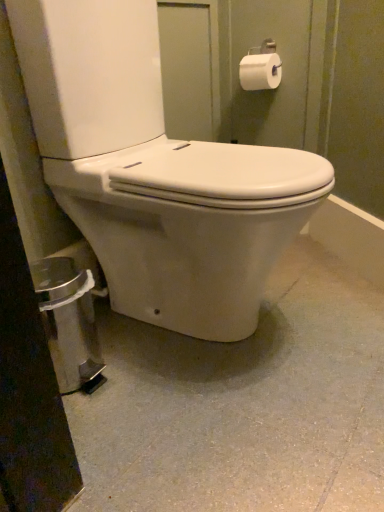
Question: Could white matte toilet paper at upper right be considered to be inside white smooth concrete at center?

Choices:
 (A) yes
 (B) no

Answer: (B)

Question: Does white smooth concrete at center appear on the left side of white matte toilet paper at upper right?

Choices:
 (A) yes
 (B) no

Answer: (A)

Question: From the image's perspective, is white smooth concrete at center beneath white matte toilet paper at upper right?

Choices:
 (A) no
 (B) yes

Answer: (B)

Question: Is white smooth concrete at center positioned behind white matte toilet paper at upper right?

Choices:
 (A) yes
 (B) no

Answer: (B)

Question: Is white smooth concrete at center turned away from white matte toilet paper at upper right?

Choices:
 (A) no
 (B) yes

Answer: (A)

Question: In the image, is white smooth concrete at center on the left side or the right side of white matte toilet paper at upper right?

Choices:
 (A) left
 (B) right

Answer: (A)

Question: Based on their sizes in the image, would you say white smooth concrete at center is bigger or smaller than white matte toilet paper at upper right?

Choices:
 (A) big
 (B) small

Answer: (A)

Question: Is white smooth concrete at center inside the boundaries of white matte toilet paper at upper right, or outside?

Choices:
 (A) inside
 (B) outside

Answer: (B)

Question: From the image's perspective, relative to white matte toilet paper at upper right, is white smooth concrete at center above or below?

Choices:
 (A) above
 (B) below

Answer: (B)

Question: From a real-world perspective, is white smooth concrete at center above or below white glossy toilet at center?

Choices:
 (A) above
 (B) below

Answer: (B)

Question: In terms of height, does white smooth concrete at center look taller or shorter compared to white glossy toilet at center?

Choices:
 (A) short
 (B) tall

Answer: (A)

Question: Is white smooth concrete at center inside or outside of white glossy toilet at center?

Choices:
 (A) outside
 (B) inside

Answer: (A)

Question: Is point (153, 410) closer or farther from the camera than point (86, 17)?

Choices:
 (A) farther
 (B) closer

Answer: (B)

Question: Is point (274, 75) positioned closer to the camera than point (109, 317)?

Choices:
 (A) farther
 (B) closer

Answer: (A)

Question: Do you think white matte toilet paper at upper right is within white smooth concrete at center, or outside of it?

Choices:
 (A) inside
 (B) outside

Answer: (B)